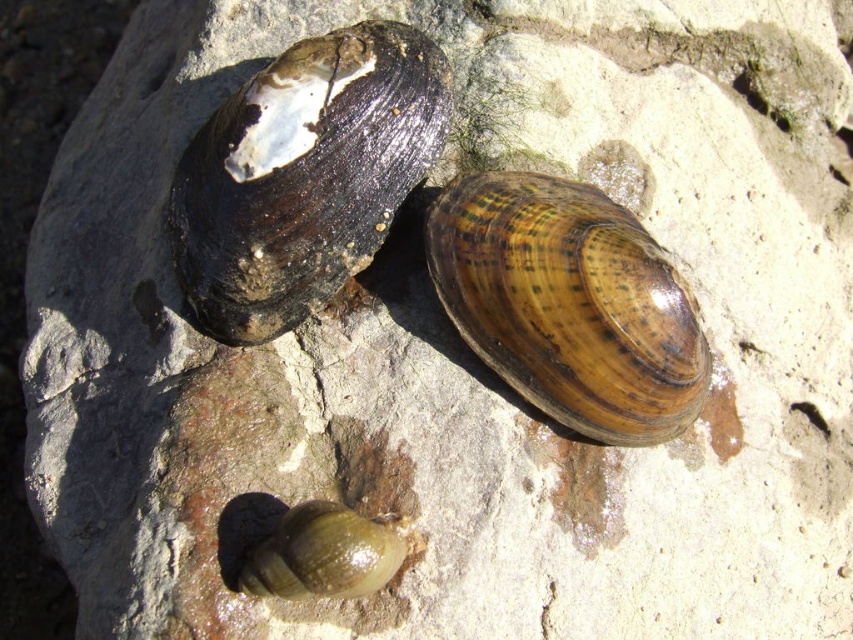
Question: Which point is farther to the camera?

Choices:
 (A) shiny black shell at upper left
 (B) brown textured shell at center

Answer: (A)

Question: Which of the following is the closest to the observer?

Choices:
 (A) brown textured shell at center
 (B) green glossy snail at lower center

Answer: (B)

Question: Does shiny black shell at upper left have a greater width compared to green glossy snail at lower center?

Choices:
 (A) no
 (B) yes

Answer: (B)

Question: Can you confirm if shiny black shell at upper left is positioned above green glossy snail at lower center?

Choices:
 (A) yes
 (B) no

Answer: (A)

Question: Is shiny black shell at upper left positioned at the back of green glossy snail at lower center?

Choices:
 (A) no
 (B) yes

Answer: (B)

Question: Considering the real-world distances, which object is closest to the green glossy snail at lower center?

Choices:
 (A) shiny black shell at upper left
 (B) brown textured shell at center

Answer: (B)